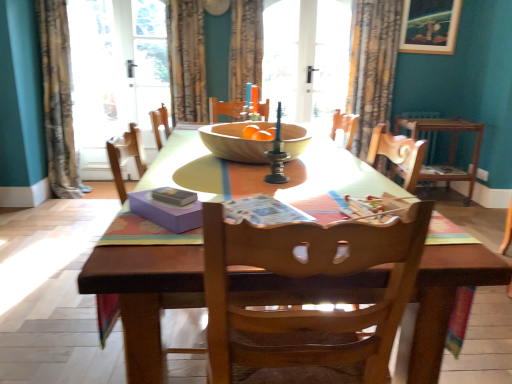
This screenshot has width=512, height=384. Describe the element at coordinates (186, 60) in the screenshot. I see `velvet-like brown curtain at upper center, which appears as the 2th curtain when viewed from the left` at that location.

What do you see at coordinates (145, 286) in the screenshot? This screenshot has width=512, height=384. I see `wooden table at center` at bounding box center [145, 286].

At what (x,y) coordinates should I click in order to perform the action: click on wooden bowl at center. Please return your answer as a coordinate pair (x, y). Looking at the image, I should click on coord(234,142).

The image size is (512, 384). Identify the location of wooden picture frame at upper right. (430, 26).

This screenshot has width=512, height=384. I want to click on velvet-like brown curtain at upper center, which appears as the 2th curtain when viewed from the left, so click(x=186, y=60).

Is transparent glass door at center behind velvet-like brown curtain at upper center, the 3th curtain in the right-to-left sequence?

Yes, it is behind velvet-like brown curtain at upper center, the 3th curtain in the right-to-left sequence.

From the image's perspective, who appears lower, transparent glass door at center or velvet-like brown curtain at upper center, which appears as the 2th curtain when viewed from the left?

velvet-like brown curtain at upper center, which appears as the 2th curtain when viewed from the left.

What's the angular difference between transparent glass door at center and velvet-like brown curtain at upper center, the 3th curtain in the right-to-left sequence,'s facing directions?

The angular difference between transparent glass door at center and velvet-like brown curtain at upper center, the 3th curtain in the right-to-left sequence, is 0.115 degrees.

Looking at this image, which is more to the left, transparent glass door at center or velvet-like brown curtain at upper center, which appears as the 2th curtain when viewed from the left?

velvet-like brown curtain at upper center, which appears as the 2th curtain when viewed from the left.

In terms of size, does patterned fabric curtain at left, which appears as the 1th curtain when viewed from the left, appear bigger or smaller than textured fabric curtain at upper center, marked as the 2th curtain in a right-to-left arrangement?

Clearly, patterned fabric curtain at left, which appears as the 1th curtain when viewed from the left, is larger in size than textured fabric curtain at upper center, marked as the 2th curtain in a right-to-left arrangement.

From a real-world perspective, is patterned fabric curtain at left, which appears as the 1th curtain when viewed from the left, on textured fabric curtain at upper center, marked as the 2th curtain in a right-to-left arrangement?

No.

Considering the positions of points (41, 7) and (256, 23), is point (41, 7) farther from camera compared to point (256, 23)?

No, it is not.

How different are the orientations of patterned fabric curtain at left, arranged as the fourth curtain when viewed from the right, and textured fabric curtain at upper center, the 3th curtain in the left-to-right sequence, in degrees?

They differ by 2.23 degrees in their facing directions.

In terms of height, does wooden chair at center, arranged as the 1th chair when viewed from the front, look taller or shorter compared to printed paper magazine at center, arranged as the second magazine when viewed from the left?

Considering their sizes, wooden chair at center, arranged as the 1th chair when viewed from the front, has more height than printed paper magazine at center, arranged as the second magazine when viewed from the left.

From a real-world perspective, is wooden chair at center, acting as the second chair starting from the right, below printed paper magazine at center, the 1th magazine from the right?

Yes, from a real-world perspective, wooden chair at center, acting as the second chair starting from the right, is under printed paper magazine at center, the 1th magazine from the right.

Is point (309, 350) more distant than point (269, 223)?

No, it is in front of (269, 223).

Find the location of a particular element. screen door below the wooden bowl at center (from a real-world perspective) is located at coordinates pyautogui.click(x=115, y=74).

Measure the distance between white glossy screen door at upper left and wooden bowl at center.

white glossy screen door at upper left and wooden bowl at center are 2.45 meters apart.

Which is closer to the camera, (140, 69) or (256, 160)?

Point (140, 69) is positioned farther from the camera compared to point (256, 160).

Considering the relative sizes of white glossy screen door at upper left and wooden bowl at center in the image provided, is white glossy screen door at upper left bigger than wooden bowl at center?

Yes.

Considering the relative positions of wooden table at center and transparent glass door at center in the image provided, is wooden table at center to the left of transparent glass door at center from the viewer's perspective?

Indeed, wooden table at center is positioned on the left side of transparent glass door at center.

Consider the image. From a real-world perspective, between wooden table at center and transparent glass door at center, who is vertically higher?

transparent glass door at center is physically above.

How far apart are wooden table at center and transparent glass door at center?

wooden table at center and transparent glass door at center are 2.26 meters apart from each other.

Is wooden table at center behind transparent glass door at center?

No, wooden table at center is in front of transparent glass door at center.

From a real-world perspective, is wooden chair at center, arranged as the 1th chair when viewed from the front, physically located above or below patterned fabric curtain at left, which appears as the 1th curtain when viewed from the left?

wooden chair at center, arranged as the 1th chair when viewed from the front, is situated lower than patterned fabric curtain at left, which appears as the 1th curtain when viewed from the left, in the real world.

Is wooden chair at center, acting as the 1th chair starting from the bottom, not within patterned fabric curtain at left, arranged as the fourth curtain when viewed from the right?

Yes, wooden chair at center, acting as the 1th chair starting from the bottom, is not within patterned fabric curtain at left, arranged as the fourth curtain when viewed from the right.

Based on the photo, between wooden chair at center, arranged as the 1th chair when viewed from the front, and patterned fabric curtain at left, which appears as the 1th curtain when viewed from the left, which one has larger width?

wooden chair at center, arranged as the 1th chair when viewed from the front.

From the image's perspective, which curtain is the 1st one above the wooden chair at center, acting as the 1th chair starting from the bottom? Please provide its 2D coordinates.

[(58, 99)]

From a real-world perspective, is transparent glass door at center physically located above or below wooden picture frame at upper right?

In terms of real-world spatial position, transparent glass door at center is below wooden picture frame at upper right.

Consider the image. Considering the sizes of transparent glass door at center and wooden picture frame at upper right in the image, is transparent glass door at center bigger or smaller than wooden picture frame at upper right?

In the image, transparent glass door at center appears to be larger than wooden picture frame at upper right.

Locate an element on the screen. window that is on the left side of wooden picture frame at upper right is located at coordinates (306, 57).

Where is `window located underneath the velvet-like brown curtain at upper center, the 3th curtain in the right-to-left sequence (from a real-world perspective)`? Image resolution: width=512 pixels, height=384 pixels. window located underneath the velvet-like brown curtain at upper center, the 3th curtain in the right-to-left sequence (from a real-world perspective) is located at coordinates (306, 57).

This screenshot has height=384, width=512. I want to click on the 3rd curtain below the textured fabric curtain at upper center, the 3th curtain in the left-to-right sequence (from the image's perspective), so click(x=58, y=99).

Which object lies further to the anchor point patterned fabric curtain at upper right, which is the 1th curtain from right to left, matte purple magazine at center, acting as the 1th magazine starting from the left, or velvet-like brown curtain at upper center, the 3th curtain in the right-to-left sequence?

matte purple magazine at center, acting as the 1th magazine starting from the left, lies further to patterned fabric curtain at upper right, which is the 1th curtain from right to left, than the other object.

Estimate the real-world distances between objects in this image. Which object is further from transparent glass door at center, textured fabric curtain at upper center, marked as the 2th curtain in a right-to-left arrangement, or wooden picture frame at upper right?

wooden picture frame at upper right is positioned further to the anchor transparent glass door at center.

Considering their positions, is patterned fabric curtain at left, which appears as the 1th curtain when viewed from the left, positioned further to wooden chair at center, acting as the second chair starting from the top, than wooden bowl at center?

Based on the image, patterned fabric curtain at left, which appears as the 1th curtain when viewed from the left, appears to be further to wooden chair at center, acting as the second chair starting from the top.

Which object lies nearer to the anchor point wooden chair at center, acting as the second chair starting from the top, textured fabric curtain at upper center, marked as the 2th curtain in a right-to-left arrangement, or matte purple magazine at center, the second magazine from the right?

Answer: Based on the image, matte purple magazine at center, the second magazine from the right, appears to be nearer to wooden chair at center, acting as the second chair starting from the top.

From the image, which object appears to be farther from patterned fabric curtain at left, which appears as the 1th curtain when viewed from the left, textured fabric curtain at upper center, the 3th curtain in the left-to-right sequence, or wooden picture frame at upper right?

wooden picture frame at upper right.

Considering their positions, is wooden bowl at center positioned further to matte purple magazine at center, acting as the 1th magazine starting from the left, than transparent glass door at center?

transparent glass door at center lies further to matte purple magazine at center, acting as the 1th magazine starting from the left, than the other object.

Estimate the real-world distances between objects in this image. Which object is further from wooden bowl at center, wooden table at center or wooden chair at center, placed as the first chair when sorted from left to right?

The object further to wooden bowl at center is wooden chair at center, placed as the first chair when sorted from left to right.

Considering their positions, is velvet-like brown curtain at upper center, which appears as the 2th curtain when viewed from the left, positioned further to printed paper magazine at center, the 1th magazine from the right, than wooden bowl at center?

velvet-like brown curtain at upper center, which appears as the 2th curtain when viewed from the left, is positioned further to the anchor printed paper magazine at center, the 1th magazine from the right.

Locate an element on the screen. bowl between printed paper magazine at center, arranged as the second magazine when viewed from the left, and textured fabric curtain at upper center, marked as the 2th curtain in a right-to-left arrangement, from front to back is located at coordinates (234, 142).

This screenshot has height=384, width=512. I want to click on magazine between printed paper magazine at center, the 1th magazine from the right, and wooden picture frame at upper right, along the z-axis, so click(x=174, y=196).

The height and width of the screenshot is (384, 512). Identify the location of window situated between velvet-like brown curtain at upper center, the 3th curtain in the right-to-left sequence, and patterned fabric curtain at upper right, which is the 1th curtain from right to left, from left to right. (306, 57).

This screenshot has width=512, height=384. In order to click on bowl located between wooden chair at center, arranged as the 1th chair when viewed from the front, and wooden picture frame at upper right in the depth direction in this screenshot , I will do `click(234, 142)`.